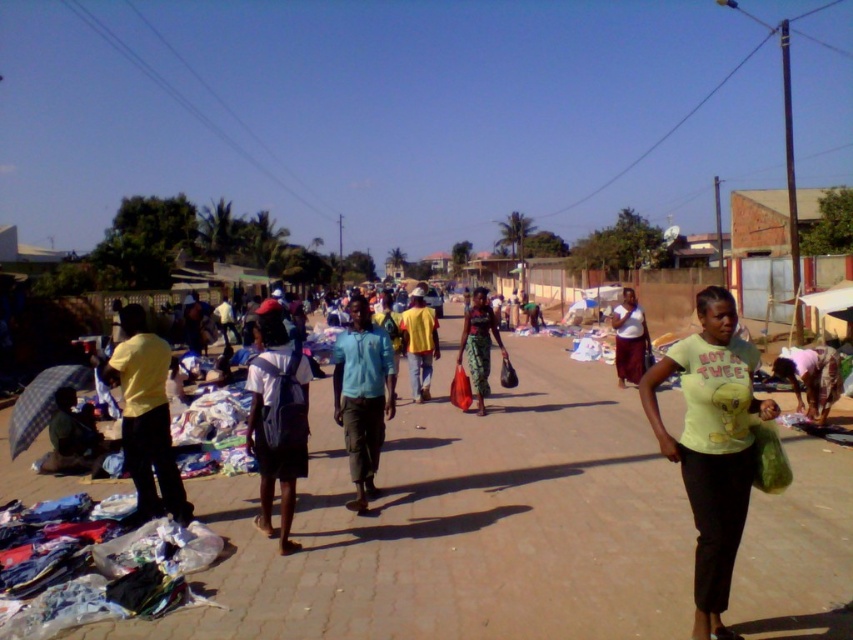
You are a photographer standing at the edge of the market. You want to take a photo of the white matte backpack at center and the matte green skirt at center. However, you notice that one of the objects is blocking the view of the other. Which object is blocking the view of the other?

The white matte backpack at center is positioned under the matte green skirt at center, so the matte green skirt at center is blocking the view of the white matte backpack at center.